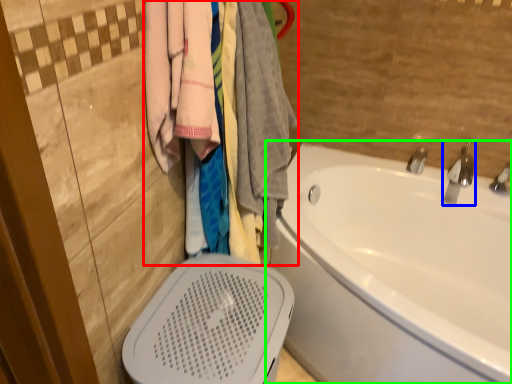
Question: Estimate the real-world distances between objects in this image. Which object is closer to closet (highlighted by a red box), tap (highlighted by a blue box) or bathtub (highlighted by a green box)?

Choices:
 (A) tap
 (B) bathtub

Answer: (B)